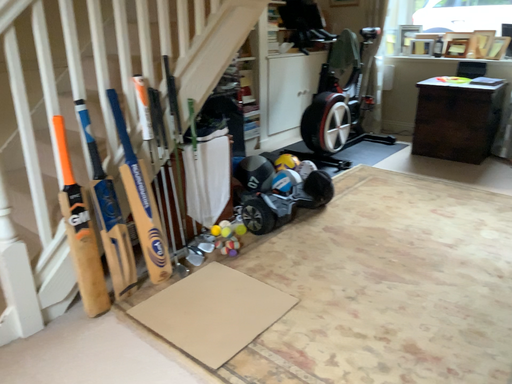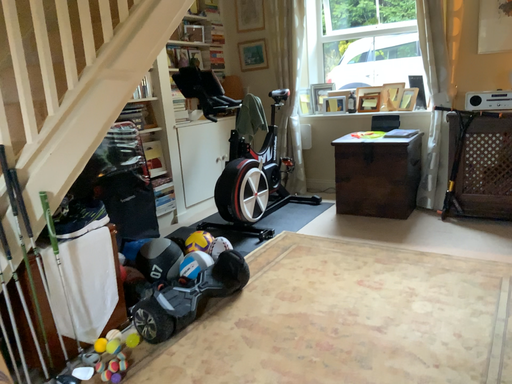
Question: How did the camera likely rotate when shooting the video?

Choices:
 (A) rotated upward
 (B) rotated downward

Answer: (A)